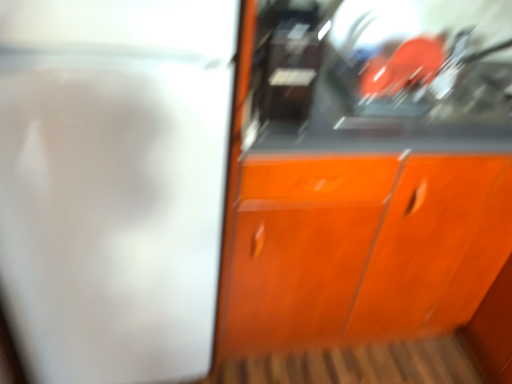
Describe the element at coordinates (113, 184) in the screenshot. Image resolution: width=512 pixels, height=384 pixels. I see `white glossy screen door at left` at that location.

At what (x,y) coordinates should I click in order to perform the action: click on white glossy screen door at left. Please return your answer as a coordinate pair (x, y). Looking at the image, I should click on (113, 184).

In order to face orange wood cabinet at center, should I rotate leftwards or rightwards?

Rotate your view right by about 21.723°.

What is the approximate height of orange wood cabinet at center?

36.00 inches.

Identify the location of orange wood cabinet at center. The width and height of the screenshot is (512, 384). (373, 179).

The image size is (512, 384). What do you see at coordinates (373, 179) in the screenshot?
I see `orange wood cabinet at center` at bounding box center [373, 179].

The width and height of the screenshot is (512, 384). Find the location of `white glossy screen door at left`. white glossy screen door at left is located at coordinates (113, 184).

Is orange wood cabinet at center to the left of white glossy screen door at left from the viewer's perspective?

In fact, orange wood cabinet at center is to the right of white glossy screen door at left.

Which is in front, orange wood cabinet at center or white glossy screen door at left?

white glossy screen door at left is more forward.

Does point (490, 16) come behind point (18, 295)?

Yes, point (490, 16) is farther from viewer.

From the image's perspective, which one is positioned higher, orange wood cabinet at center or white glossy screen door at left?

white glossy screen door at left appears higher in the image.

From a real-world perspective, who is located lower, orange wood cabinet at center or white glossy screen door at left?

orange wood cabinet at center, from a real-world perspective.

Can you confirm if orange wood cabinet at center is thinner than white glossy screen door at left?

Yes.

In the scene shown: Is orange wood cabinet at center taller or shorter than white glossy screen door at left?

Considering their sizes, orange wood cabinet at center has less height than white glossy screen door at left.

Is orange wood cabinet at center bigger or smaller than white glossy screen door at left?

orange wood cabinet at center is bigger than white glossy screen door at left.

Is white glossy screen door at left inside orange wood cabinet at center?

Actually, white glossy screen door at left is outside orange wood cabinet at center.

Would you consider orange wood cabinet at center to be distant from white glossy screen door at left?

No.

Could you tell me if orange wood cabinet at center is facing white glossy screen door at left?

No, orange wood cabinet at center is not aimed at white glossy screen door at left.

This screenshot has height=384, width=512. In the image, there is a white glossy screen door at left. What are the coordinates of `cabinetry below it (from a real-world perspective)` in the screenshot? It's located at (373, 179).

Is white glossy screen door at left at the left side of orange wood cabinet at center?

Yes.

In the scene shown: Which object is more forward, white glossy screen door at left or orange wood cabinet at center?

Positioned in front is white glossy screen door at left.

Which is farther from the camera, (99, 17) or (369, 265)?

Point (369, 265)

From the image's perspective, which one is positioned lower, white glossy screen door at left or orange wood cabinet at center?

orange wood cabinet at center, from the image's perspective.

From a real-world perspective, who is located higher, white glossy screen door at left or orange wood cabinet at center?

white glossy screen door at left.

Which of these two, white glossy screen door at left or orange wood cabinet at center, is wider?

white glossy screen door at left is wider.

Is white glossy screen door at left taller than orange wood cabinet at center?

Yes, white glossy screen door at left is taller than orange wood cabinet at center.

Considering the relative sizes of white glossy screen door at left and orange wood cabinet at center in the image provided, is white glossy screen door at left bigger than orange wood cabinet at center?

No, white glossy screen door at left is not bigger than orange wood cabinet at center.

Is orange wood cabinet at center inside white glossy screen door at left?

No, orange wood cabinet at center is not a part of white glossy screen door at left.

Consider the image. Is white glossy screen door at left positioned far away from orange wood cabinet at center?

No, white glossy screen door at left is in close proximity to orange wood cabinet at center.

Does white glossy screen door at left turn towards orange wood cabinet at center?

No.

There is a orange wood cabinet at center. Identify the location of screen door above it (from a real-world perspective). (113, 184).

Image resolution: width=512 pixels, height=384 pixels. In the image, there is a white glossy screen door at left. Identify the location of cabinetry below it (from the image's perspective). (x=373, y=179).

You are a GUI agent. You are given a task and a screenshot of the screen. Output one action in this format:
    pyautogui.click(x=<x>, y=<y>)
    Task: Click on the cabinetry that appears on the right of white glossy screen door at left
    
    Given the screenshot: What is the action you would take?
    pyautogui.click(x=373, y=179)